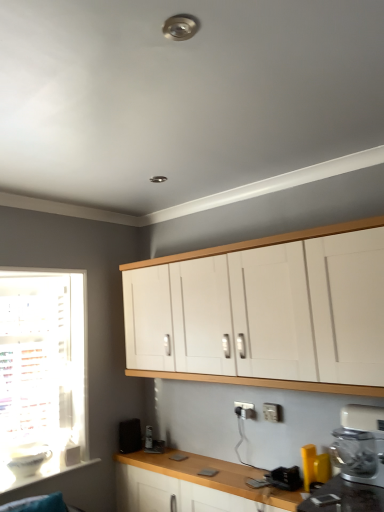
Question: Which direction should I rotate to look at metallic silver toaster at lower center, which ranks as the second appliance in left-to-right order, — up or down?

Choices:
 (A) down
 (B) up

Answer: (A)

Question: Could you tell me if yellow plastic spatula at lower right, which appears as the 3th appliance when viewed from the back, is facing white plastic mixer at lower right?

Choices:
 (A) yes
 (B) no

Answer: (B)

Question: Is yellow plastic spatula at lower right, the first appliance from the front, not inside white plastic mixer at lower right?

Choices:
 (A) yes
 (B) no

Answer: (A)

Question: Is white plastic mixer at lower right completely or partially inside yellow plastic spatula at lower right, the first appliance from the front?

Choices:
 (A) no
 (B) yes

Answer: (A)

Question: Is yellow plastic spatula at lower right, which appears as the 3th appliance when viewed from the back, positioned far away from white plastic mixer at lower right?

Choices:
 (A) no
 (B) yes

Answer: (A)

Question: Is yellow plastic spatula at lower right, which appears as the 3th appliance when viewed from the back, facing away from white plastic mixer at lower right?

Choices:
 (A) yes
 (B) no

Answer: (B)

Question: Is the position of yellow plastic spatula at lower right, which appears as the 3th appliance when viewed from the back, less distant than that of white plastic mixer at lower right?

Choices:
 (A) no
 (B) yes

Answer: (A)

Question: Can we say white plastic electric outlet at lower center lies outside white matte cabinet at upper center?

Choices:
 (A) yes
 (B) no

Answer: (A)

Question: Can you confirm if white plastic electric outlet at lower center is bigger than white matte cabinet at upper center?

Choices:
 (A) yes
 (B) no

Answer: (B)

Question: From a real-world perspective, is white plastic electric outlet at lower center located beneath white matte cabinet at upper center?

Choices:
 (A) no
 (B) yes

Answer: (B)

Question: From the image's perspective, is white plastic electric outlet at lower center over white matte cabinet at upper center?

Choices:
 (A) yes
 (B) no

Answer: (B)

Question: Is the position of white plastic electric outlet at lower center less distant than that of white matte cabinet at upper center?

Choices:
 (A) yes
 (B) no

Answer: (B)

Question: Considering the relative positions of white plastic electric outlet at lower center and white matte cabinet at upper center in the image provided, is white plastic electric outlet at lower center behind white matte cabinet at upper center?

Choices:
 (A) yes
 (B) no

Answer: (A)

Question: Are white plastic electric outlet at lower center and yellow plastic spatula at lower right, the first appliance from the front, beside each other?

Choices:
 (A) no
 (B) yes

Answer: (A)